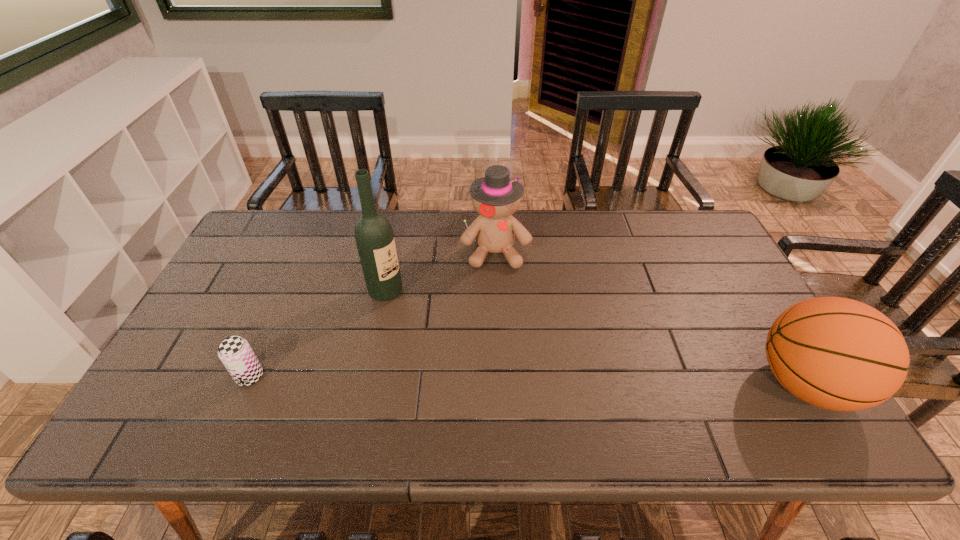
At what (x,y) coordinates should I click in order to perform the action: click on free spot between the tallest object and the rightmost object. Please return your answer as a coordinate pair (x, y). The image size is (960, 540). Looking at the image, I should click on (595, 338).

The height and width of the screenshot is (540, 960). I want to click on vacant space that is in between the third object from right to left and the rag_doll, so click(441, 272).

At what (x,y) coordinates should I click in order to perform the action: click on vacant area between the rag_doll and the rightmost object. Please return your answer as a coordinate pair (x, y). Looking at the image, I should click on (650, 318).

The image size is (960, 540). I want to click on vacant space in between the shortest object and the rightmost object, so click(527, 380).

Locate an element on the screen. vacant space that is in between the second object from left to right and the beer can is located at coordinates (318, 334).

I want to click on free space between the rag_doll and the rightmost object, so click(x=650, y=318).

This screenshot has height=540, width=960. I want to click on object identified as the closest to the basketball, so click(x=496, y=197).

What are the coordinates of `the third closest object relative to the shortest object` in the screenshot? It's located at (836, 353).

Identify the location of free spot that satisfies the following two spatial constraints: 1. on the back side of the farthest object; 2. on the right side of the third object from right to left. The image size is (960, 540). (395, 252).